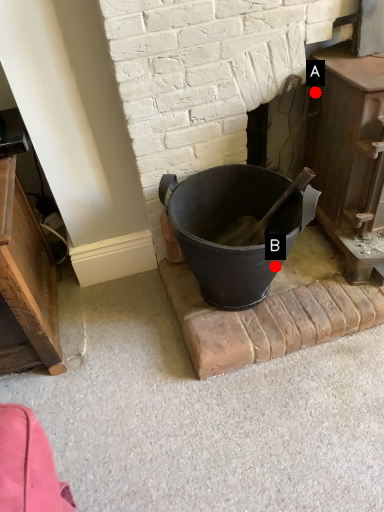
Question: Two points are circled on the image, labeled by A and B beside each circle. Which point is closer to the camera?

Choices:
 (A) A is closer
 (B) B is closer

Answer: (B)